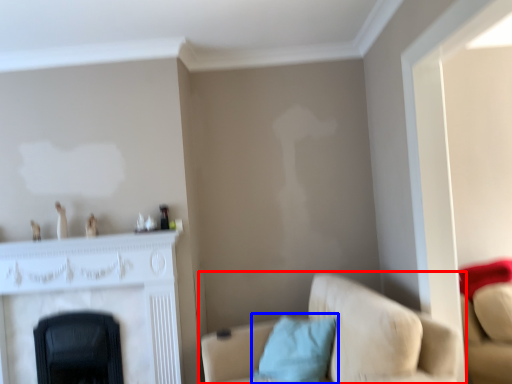
Question: Which object appears farthest to the camera in this image, studio couch (highlighted by a red box) or pillow (highlighted by a blue box)?

Choices:
 (A) studio couch
 (B) pillow

Answer: (B)